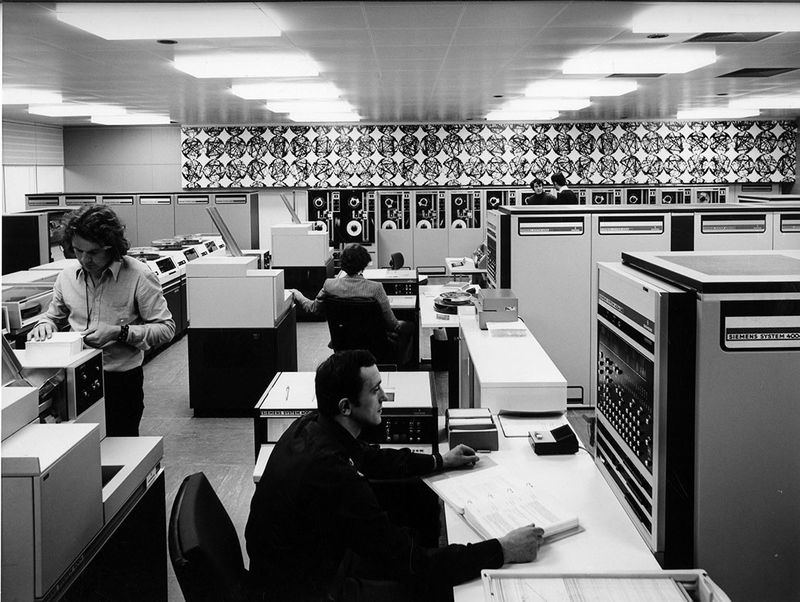
Identify the location of ceiling. Image resolution: width=800 pixels, height=602 pixels. (433, 49).